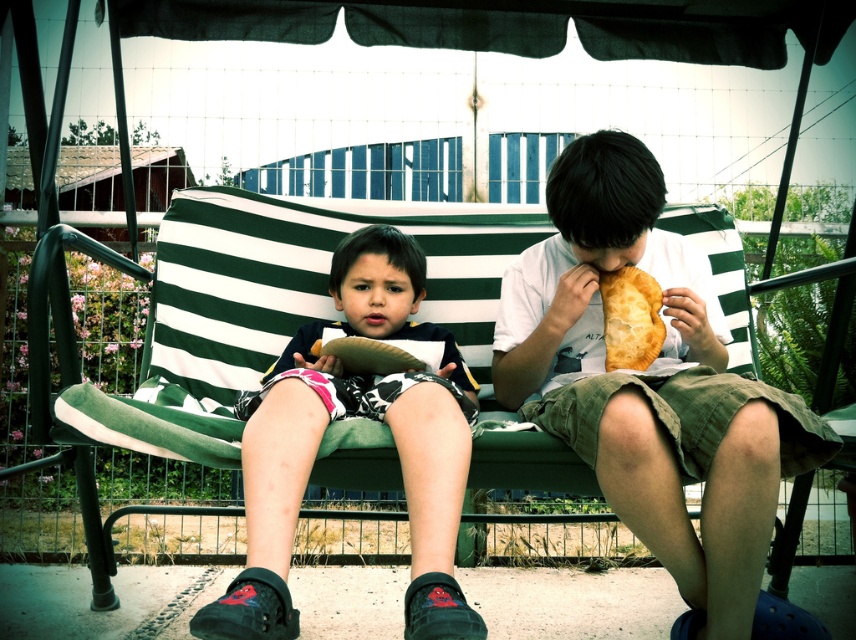
You are a photographer setting up a shot of the two children on the bench. You want to ensure that the matte white shirt at center and the green striped cushion at center are both clearly visible in the frame. Given their sizes, which object should you focus on first to ensure proper framing?

The matte white shirt at center has a smaller size compared to the green striped cushion at center, so you should focus on the matte white shirt at center first to ensure it is properly framed before adjusting for the larger cushion.

You are standing at the point with coordinates point (603, 320) and want to walk towards the direction of point (378, 413). According to the scene, which direction should you move?

You should move forward because point (378, 413) is in front of point (603, 320).